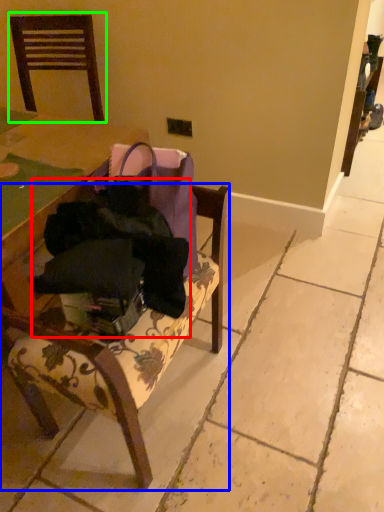
Question: Which object is positioned closest to clothing (highlighted by a red box)? Select from chair (highlighted by a blue box) and chair (highlighted by a green box).

Choices:
 (A) chair
 (B) chair

Answer: (A)